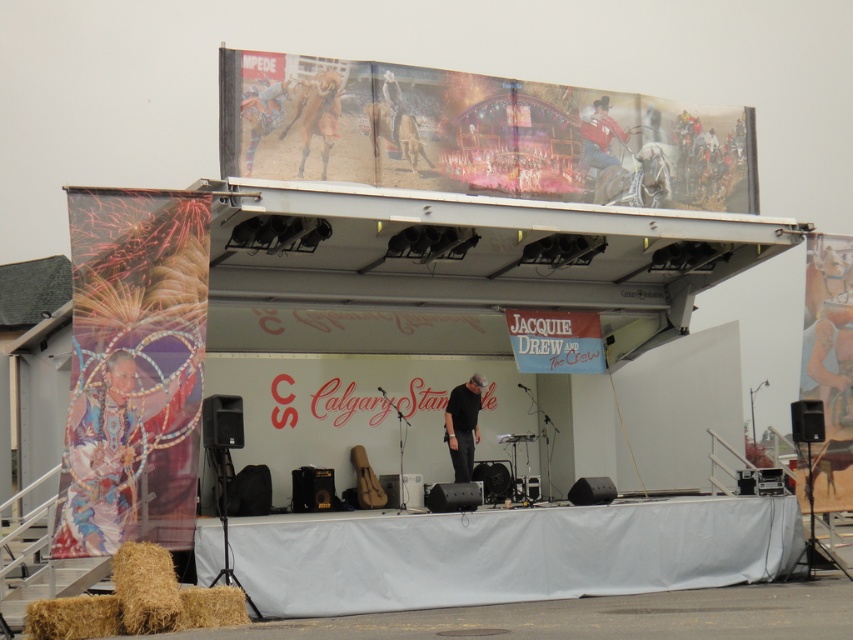
Is beaded fabric person at left to the right of red leather cowboy at center from the viewer's perspective?

Incorrect, beaded fabric person at left is not on the right side of red leather cowboy at center.

From the picture: Which is more to the right, beaded fabric person at left or red leather cowboy at center?

red leather cowboy at center is more to the right.

Where is `beaded fabric person at left`? The height and width of the screenshot is (640, 853). beaded fabric person at left is located at coordinates (99, 464).

Locate an element on the screen. beaded fabric person at left is located at coordinates (99, 464).

Between black fabric at center and red leather cowboy at center, which one has more height?

With more height is black fabric at center.

Between black fabric at center and red leather cowboy at center, which one is positioned higher?

Positioned higher is red leather cowboy at center.

Who is more distant from viewer, (461, 392) or (584, 136)?

Positioned behind is point (461, 392).

Locate an element on the screen. black fabric at center is located at coordinates (463, 426).

The height and width of the screenshot is (640, 853). Describe the element at coordinates (99, 464) in the screenshot. I see `beaded fabric person at left` at that location.

Is beaded fabric person at left further to the viewer compared to black fabric at center?

That is False.

Is point (57, 536) closer to viewer compared to point (445, 429)?

Yes, point (57, 536) is closer to viewer.

Image resolution: width=853 pixels, height=640 pixels. Find the location of `beaded fabric person at left`. beaded fabric person at left is located at coordinates (99, 464).